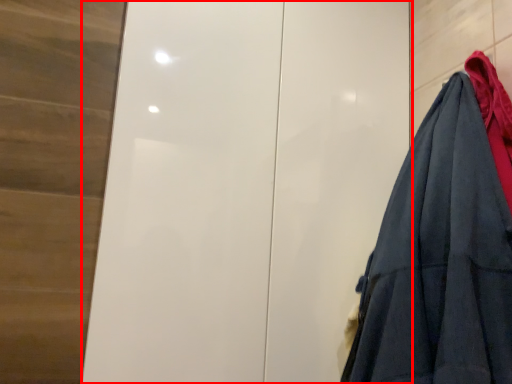
Question: From the image's perspective, where is door (annotated by the red box) located relative to garment?

Choices:
 (A) above
 (B) below

Answer: (A)